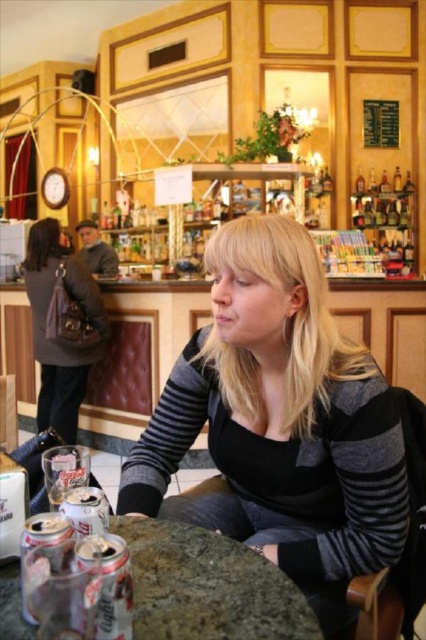
Question: Which of these objects is positioned farthest from the granite table at center?

Choices:
 (A) striped sweater at center
 (B) dark gray wool coat at left

Answer: (B)

Question: Can you confirm if striped sweater at center is positioned to the left of granite table at center?

Choices:
 (A) no
 (B) yes

Answer: (A)

Question: Does granite table at center have a greater width compared to dark gray wool coat at left?

Choices:
 (A) yes
 (B) no

Answer: (B)

Question: Which of the following is the closest to the observer?

Choices:
 (A) (51, 413)
 (B) (279, 509)

Answer: (B)

Question: Which object appears closest to the camera in this image?

Choices:
 (A) granite table at center
 (B) striped sweater at center
 (C) dark gray wool coat at left

Answer: (A)

Question: Is striped sweater at center to the right of granite table at center from the viewer's perspective?

Choices:
 (A) no
 (B) yes

Answer: (B)